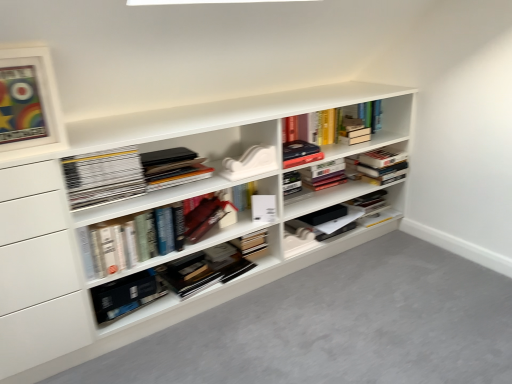
Question: Based on their sizes in the image, would you say matte white picture frame at upper left is bigger or smaller than hardcover book at center, placed as the second book when sorted from top to bottom?

Choices:
 (A) big
 (B) small

Answer: (B)

Question: Is matte white picture frame at upper left in front of or behind hardcover book at center, placed as the second book when sorted from top to bottom, in the image?

Choices:
 (A) front
 (B) behind

Answer: (A)

Question: Which of these objects is positioned closest to the white matte paperback book at center, the first paperback book viewed from the top?

Choices:
 (A) matte white picture frame at upper left
 (B) matte black box at center
 (C) white matte bookshelf at center
 (D) hardcover book at center, the first paperback book when ordered from left to right
 (E) hardcover book at center

Answer: (E)

Question: Based on their relative distances, which object is farther from the matte black book at center, which ranks as the first book in top-to-bottom order?

Choices:
 (A) hardcover book at center, placed as the second book when sorted from top to bottom
 (B) hardcover book at center, which is counted as the second paperback book, starting from the top
 (C) matte black box at center
 (D) white matte paperback book at center, the 2th paperback book ordered from the bottom
 (E) hardcover book at center

Answer: (C)